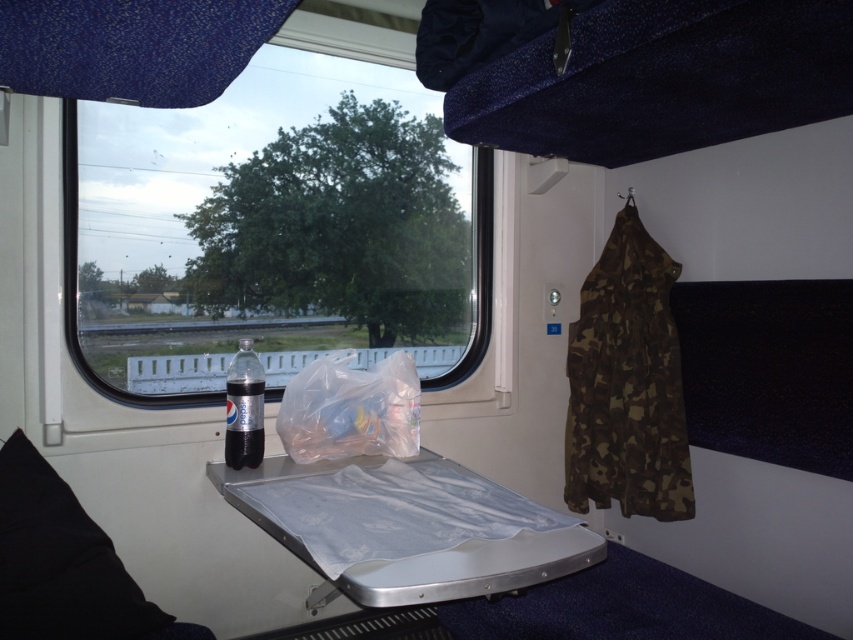
Consider the image. You are a passenger sitting in the train compartment and want to reach the translucent plastic bag at center to get your snack. Is the black fabric pillow at lower left blocking your access to it?

The black fabric pillow at lower left is in front of the translucent plastic bag at center, so it is blocking your access to the bag.

You are inside the train compartment and want to check the outside view through the transparent plastic window at center. Where exactly should you look on the window to see the tree and grassy area?

The transparent plastic window at center is located at point [277,220], so you should look at that coordinate on the window to see the tree and grassy area.